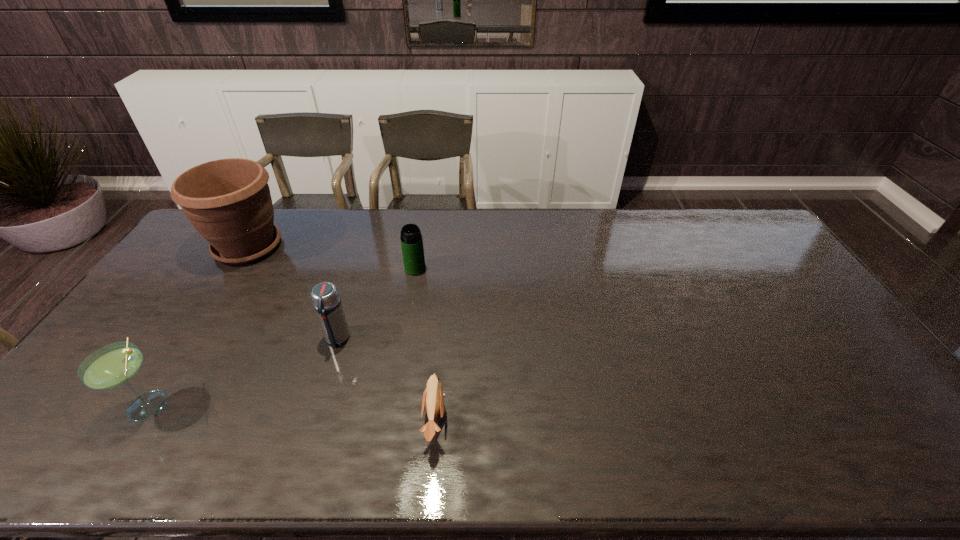
The height and width of the screenshot is (540, 960). What are the coordinates of `the tallest object` in the screenshot? It's located at (228, 201).

Locate an element on the screen. the second object from right to left is located at coordinates (411, 239).

Locate an element on the screen. the right thermos bottle is located at coordinates (411, 239).

Identify the location of the third object from right to left. Image resolution: width=960 pixels, height=540 pixels. (325, 297).

I want to click on the third farthest object, so click(x=325, y=297).

I want to click on martini, so click(115, 364).

Where is `bird`? Image resolution: width=960 pixels, height=540 pixels. bird is located at coordinates (433, 398).

Where is `the shortest object`? The width and height of the screenshot is (960, 540). the shortest object is located at coordinates (433, 398).

You are a GUI agent. You are given a task and a screenshot of the screen. Output one action in this format:
    pyautogui.click(x=<x>, y=<y>)
    Task: Click on the vacant space situated 0.390m on the right of the tallest object
    The image size is (960, 540).
    Given the screenshot: What is the action you would take?
    pyautogui.click(x=397, y=247)

You are a GUI agent. You are given a task and a screenshot of the screen. Output one action in this format:
    pyautogui.click(x=<x>, y=<y>)
    Task: Click on the free space located from the spout of the right thermos bottle
    
    Given the screenshot: What is the action you would take?
    pyautogui.click(x=408, y=308)